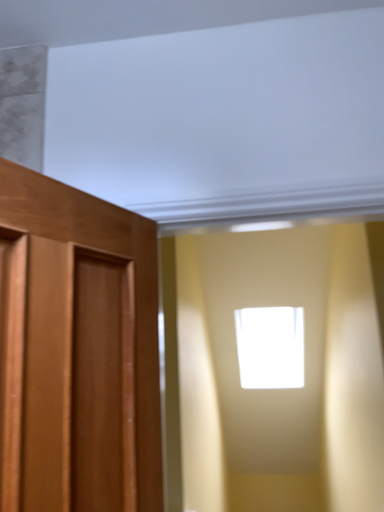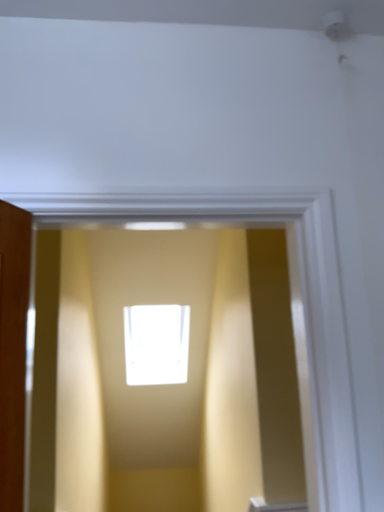
Question: How did the camera likely rotate when shooting the video?

Choices:
 (A) rotated left
 (B) rotated right

Answer: (B)